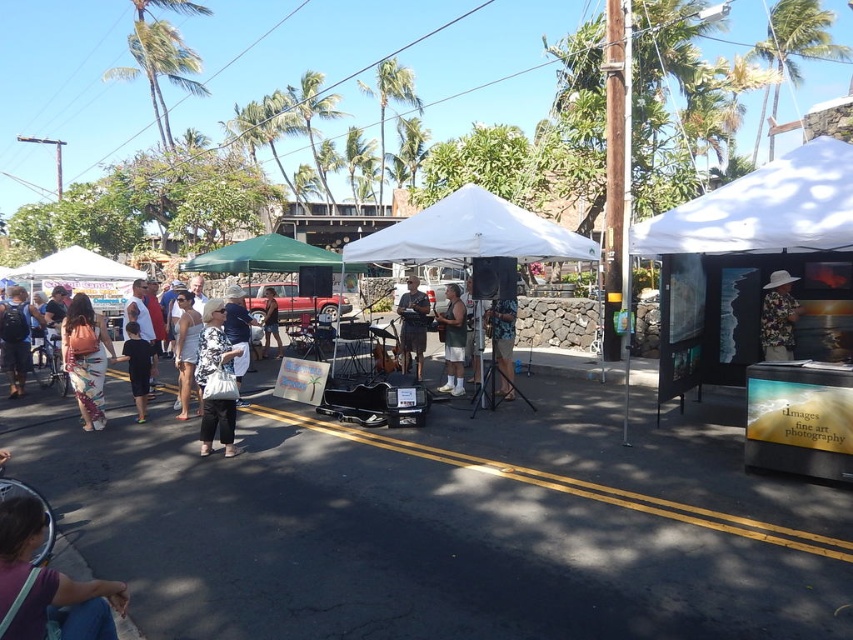
Question: Which of the following is the closest to the observer?

Choices:
 (A) black cotton shirt at lower left
 (B) camouflage shorts at center
 (C) white fabric canopy at center

Answer: (C)

Question: Can you confirm if floral fabric dress at center is smaller than white fabric dress at center?

Choices:
 (A) no
 (B) yes

Answer: (A)

Question: Which object is positioned closest to the green fabric canopy at center?

Choices:
 (A) white textured bag at center
 (B) floral shirt at center
 (C) floral skirt at lower left

Answer: (C)

Question: Which of the following is the closest to the observer?

Choices:
 (A) (200, 317)
 (B) (403, 323)

Answer: (A)

Question: Does denim jeans at lower left have a greater width compared to camouflage shorts at center?

Choices:
 (A) yes
 (B) no

Answer: (B)

Question: Is white textured bag at center below floral shirt at center?

Choices:
 (A) yes
 (B) no

Answer: (A)